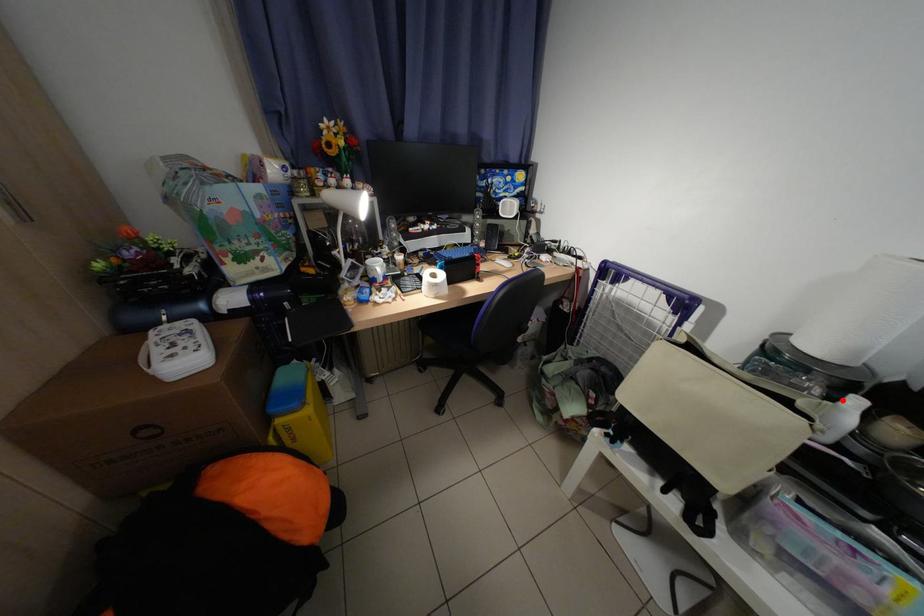
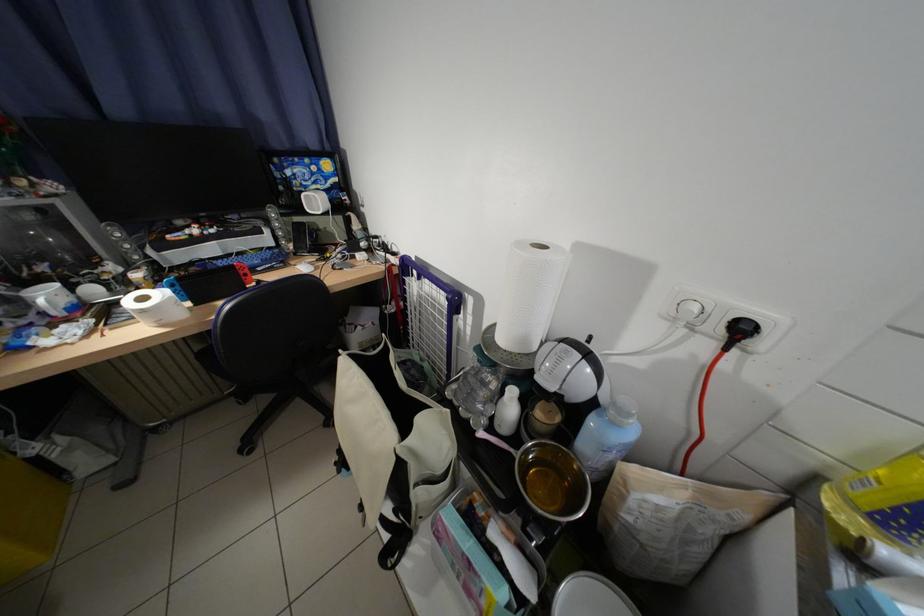
Locate, in the second image, the point that corresponds to the highlighted location in the first image.

(514, 392)